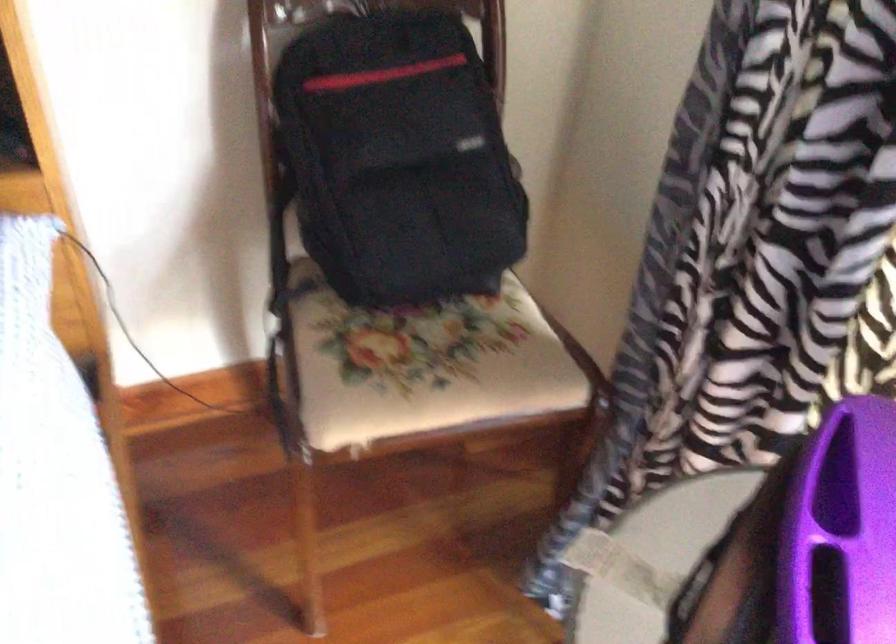
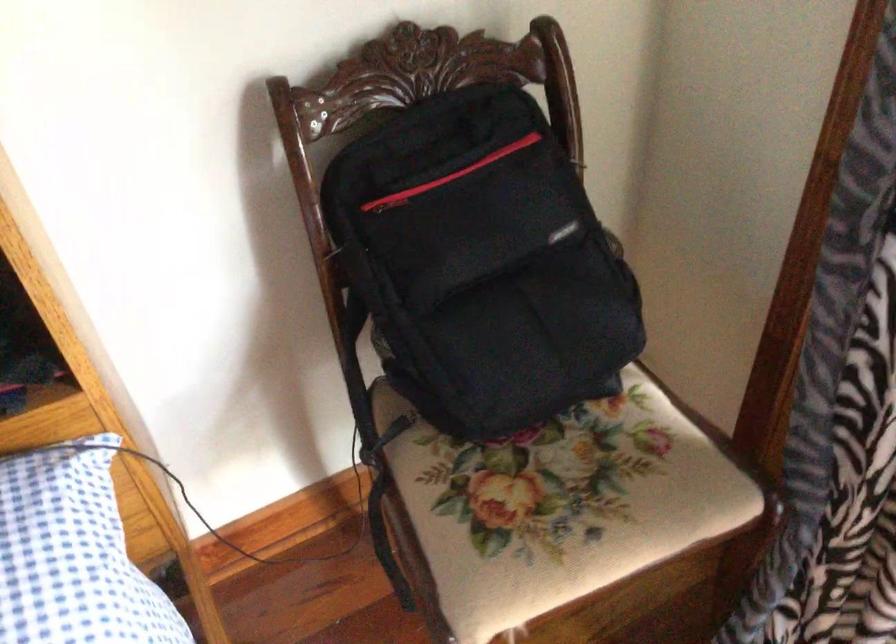
Question: I am providing you with two images of the same scene from different viewpoints. Please identify which objects are invisible in image2.

Choices:
 (A) black backpack handle
 (B) black backpack
 (C) chair sitting surface
 (D) none of these

Answer: (D)